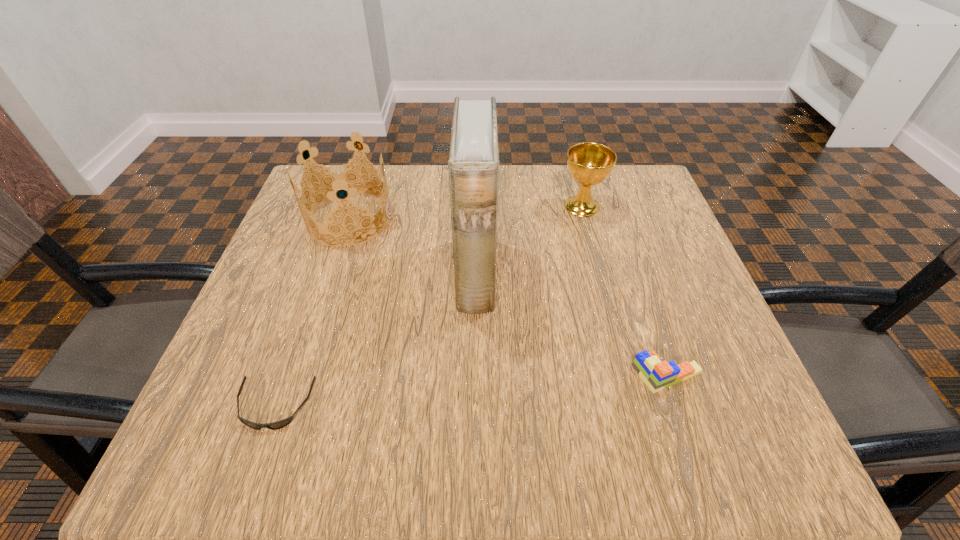
Image resolution: width=960 pixels, height=540 pixels. What are the coordinates of `crown that is at the far edge` in the screenshot? It's located at tap(338, 178).

The height and width of the screenshot is (540, 960). Identify the location of chalice that is at the far edge. (589, 163).

This screenshot has width=960, height=540. I want to click on object located in the near edge section of the desktop, so click(x=280, y=424).

This screenshot has height=540, width=960. Identify the location of crown that is at the left edge. (338, 178).

Locate an element on the screen. This screenshot has height=540, width=960. sunglasses that is at the left edge is located at coordinates (280, 424).

Locate an element on the screen. This screenshot has width=960, height=540. chalice located at the right edge is located at coordinates (589, 163).

Where is `Lego positioned at the right edge`? Lego positioned at the right edge is located at coordinates (657, 375).

The height and width of the screenshot is (540, 960). I want to click on object that is at the far left corner, so click(338, 178).

This screenshot has height=540, width=960. Identify the location of object present at the near left corner. (280, 424).

You are a GUI agent. You are given a task and a screenshot of the screen. Output one action in this format:
    pyautogui.click(x=<x>, y=<y>)
    Task: Click on the object located in the far right corner section of the desktop
    
    Given the screenshot: What is the action you would take?
    pyautogui.click(x=589, y=163)